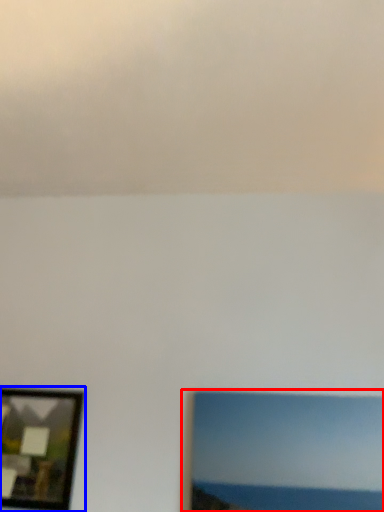
Question: Which point is closer to the camera, picture frame (highlighted by a red box) or picture frame (highlighted by a blue box)?

Choices:
 (A) picture frame
 (B) picture frame

Answer: (A)